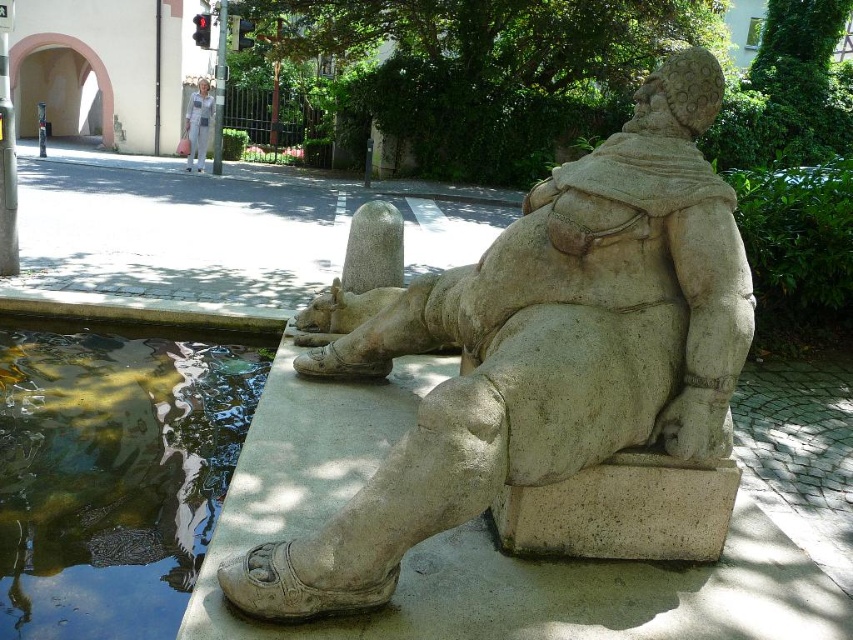
Question: Among these points, which one is farthest from the camera?

Choices:
 (A) (213, 509)
 (B) (207, 96)

Answer: (B)

Question: Does stone statue at center appear on the right side of white fabric pants at center?

Choices:
 (A) no
 (B) yes

Answer: (B)

Question: Is stone statue at center to the left of clear glass pool at lower left from the viewer's perspective?

Choices:
 (A) no
 (B) yes

Answer: (A)

Question: Among these points, which one is farthest from the camera?

Choices:
 (A) (207, 115)
 (B) (430, 413)

Answer: (A)

Question: Is stone statue at center to the left of clear glass pool at lower left from the viewer's perspective?

Choices:
 (A) yes
 (B) no

Answer: (B)

Question: Which point appears farthest from the camera in this image?

Choices:
 (A) (196, 115)
 (B) (701, 164)

Answer: (A)